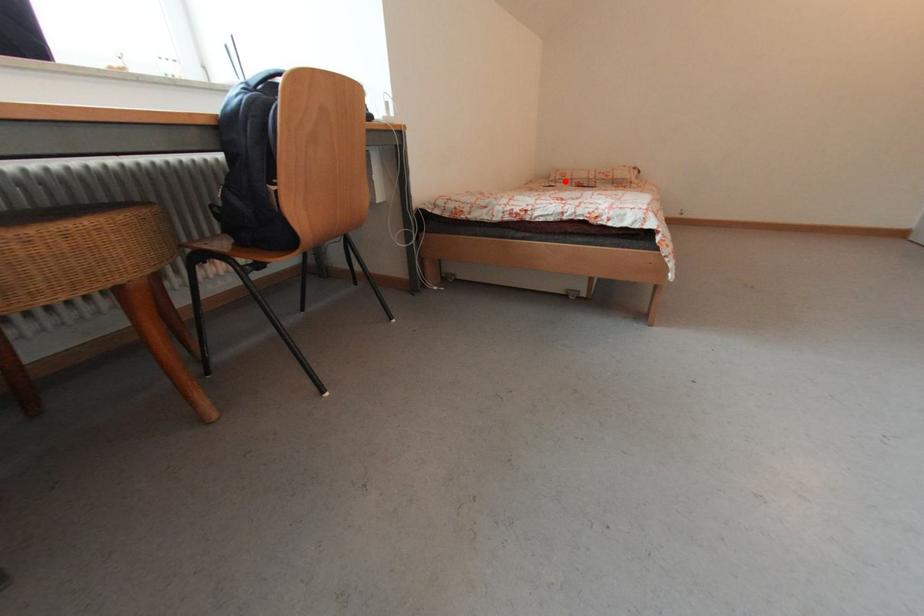
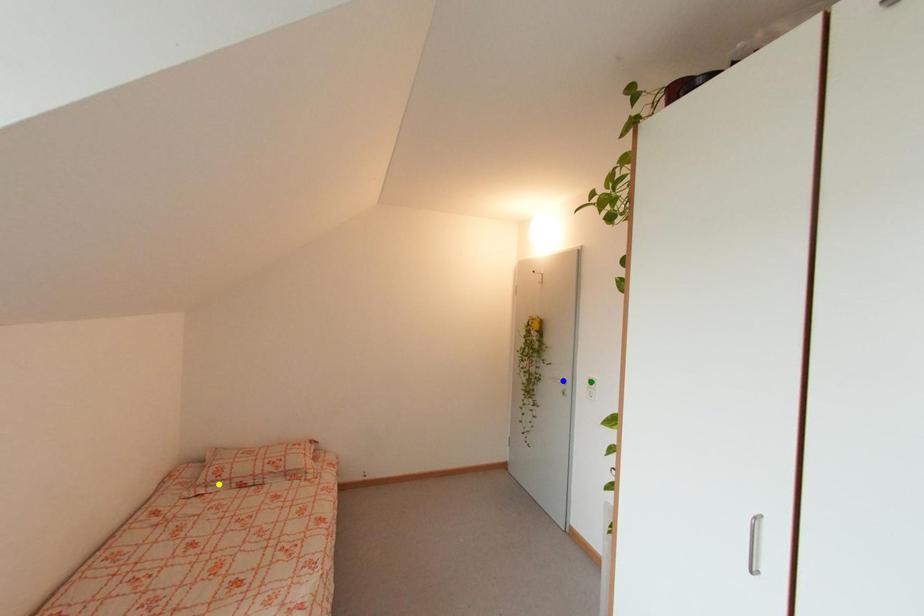
Question: I am providing you with two images of the same scene from different viewpoints. A red point is marked on the first image. You are given multiple points on the second image. Which mark in image 2 goes with the point in image 1?

Choices:
 (A) green point
 (B) blue point
 (C) yellow point

Answer: (C)